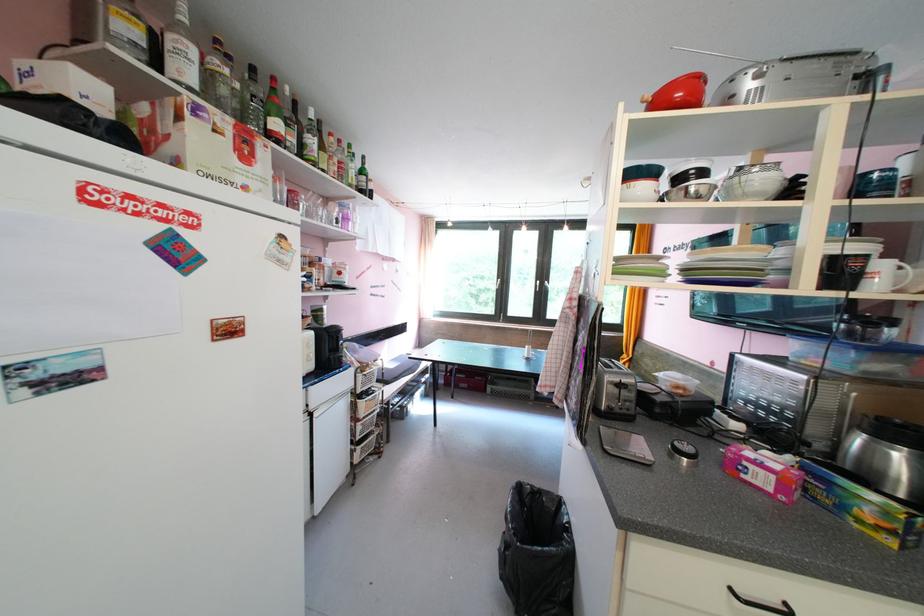
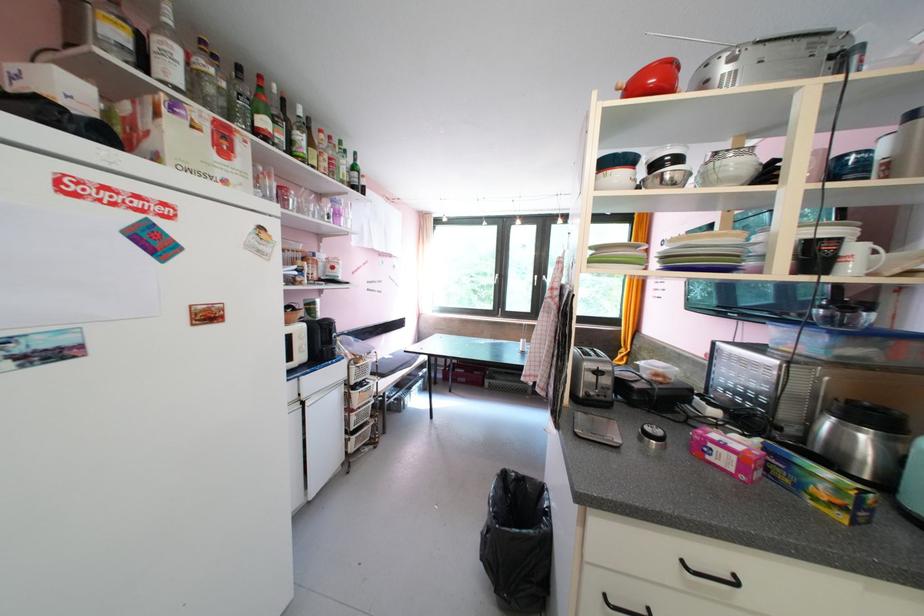
Where in the second image is the point corresponding to pixel 708 79 from the first image?

(678, 63)